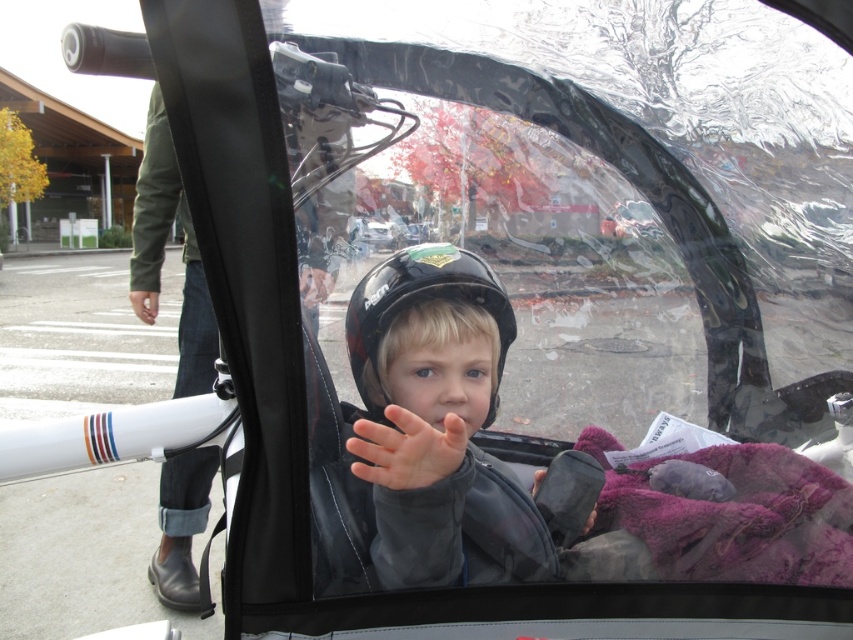
You are a safety inspector checking the distance between the matte black helmet at center and the viewer. According to safety regulations, this distance must be at least 75 centimeters to ensure proper visibility. Is the current distance compliant with the safety standards?

The matte black helmet at center and viewer are 74.12 centimeters apart, which is less than the required 75 centimeters. Therefore, the current distance does not comply with the safety standards.

You are a delivery robot with a package that needs to be handed to the child in the sidecar. The robot has a 1.2 meter arm. Can the robot reach from the black leather boot at left to the black matte glove at center to deliver the package?

The distance between the black leather boot at left and the black matte glove at center is 1.40 meters. Since the robot arm is only 1.2 meters, it cannot reach the distance required.